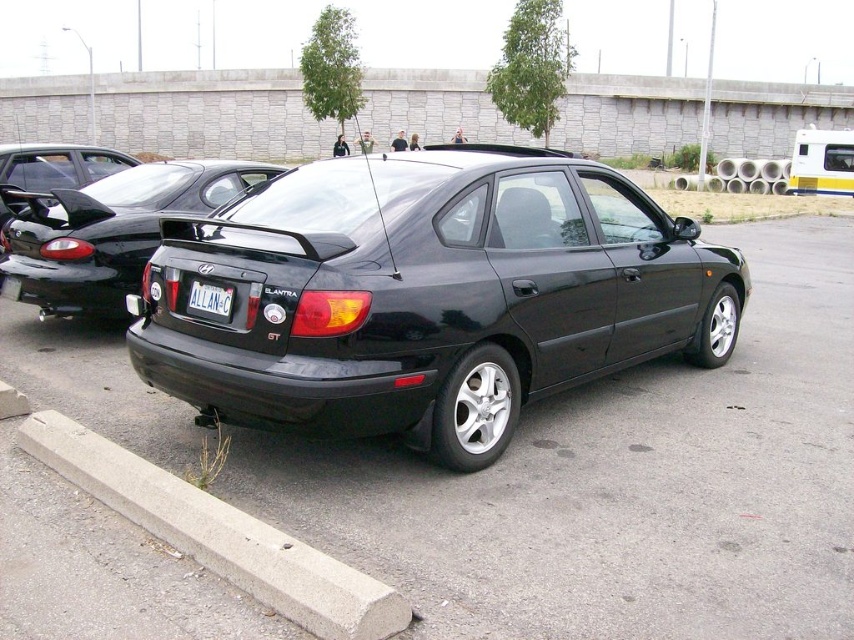
You are standing at the point marked by the coordinates point (219, 534). You want to walk towards the black Hyundai Elantra GT parked diagonally. Which direction should you move to reach the car?

The point (219, 534) is located at the concrete at lower left. To reach the black Hyundai Elantra GT parked diagonally, you should move towards the upper right direction from the concrete at lower left.

You are standing at the origin point of the coordinate system. You want to move towards the glossy black sedan at center. What are the coordinates you need to move to reach it?

The coordinates to reach the glossy black sedan at center are at point (427, 296).